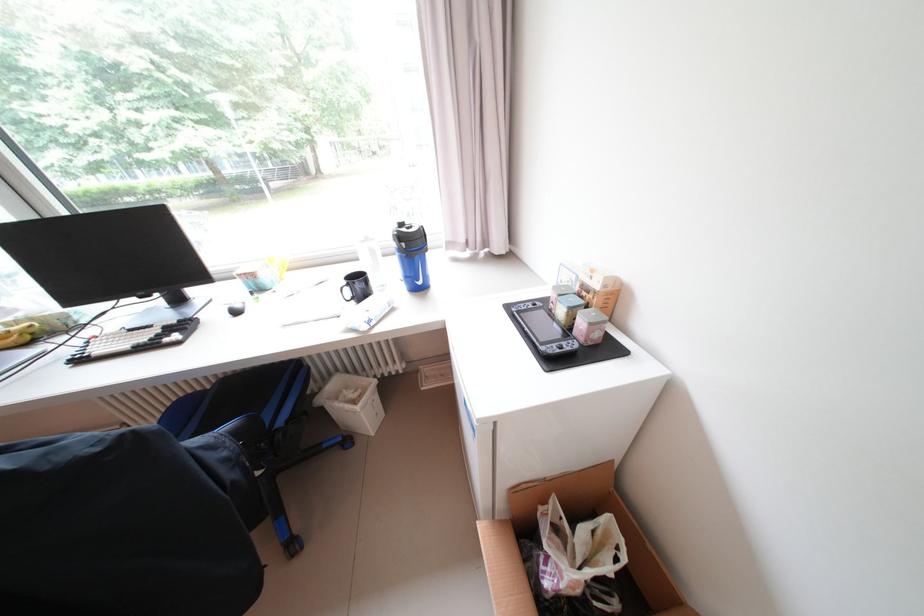
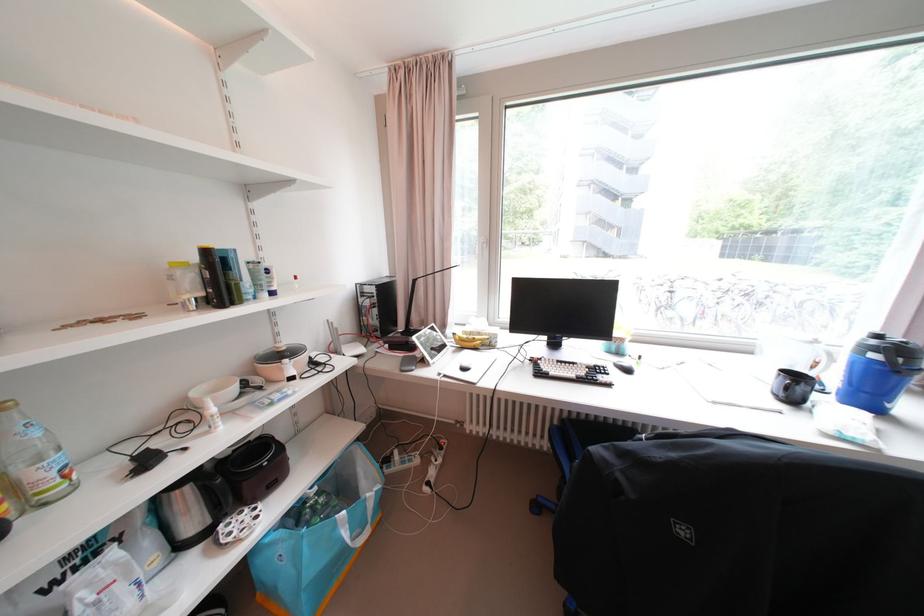
Find the pixel in the second image that matches point (411, 246) in the first image.

(909, 361)